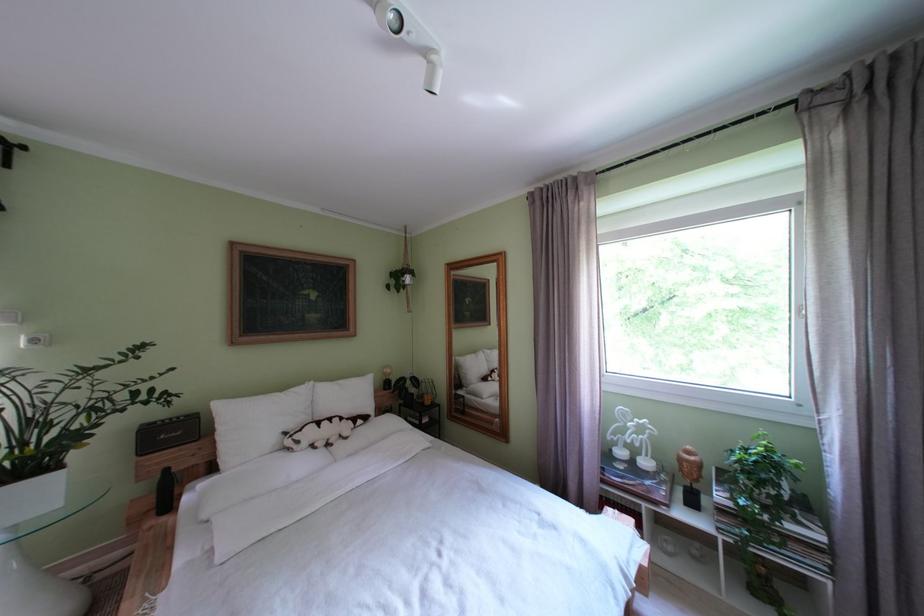
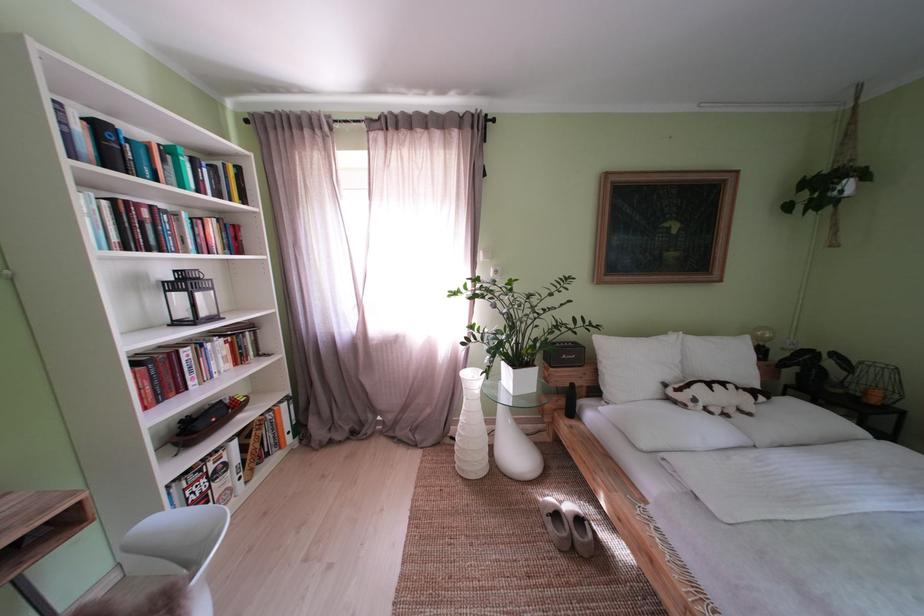
Where in the second image is the point corresponding to pixel 310 447 from the first image?

(706, 406)